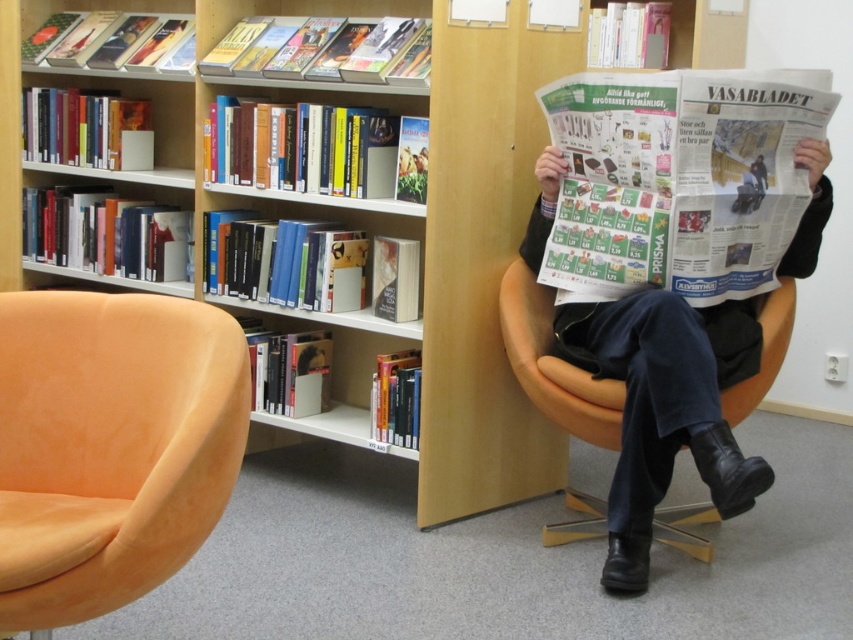
You are a visitor looking for a place to sit and read. You see the suede orange swivel chair at left and the orange fabric armchair at center. Which chair is closer to the ceiling?

The orange fabric armchair at center is closer to the ceiling because the suede orange swivel chair at left is positioned under it.

Based on the photo, you are standing in the library and want to reach the wooden bookshelf at upper center from the orange fabric armchair at center. Which direction should you move?

You should move forward because the wooden bookshelf at upper center is closer to you than the orange fabric armchair at center.